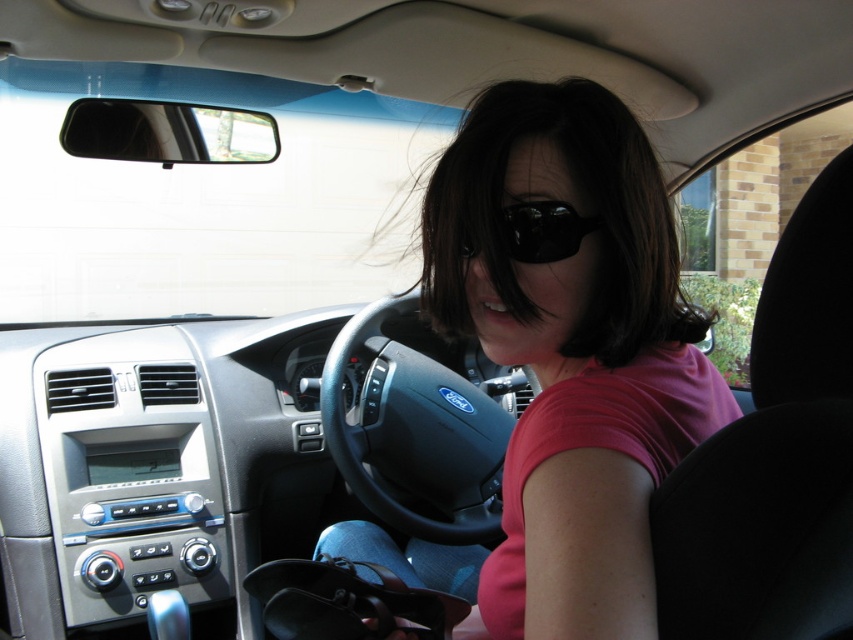
Question: Does pink matte shirt at center have a smaller size compared to black reflective sunglasses at center?

Choices:
 (A) yes
 (B) no

Answer: (B)

Question: In this image, where is pink matte shirt at center located relative to black reflective sunglasses at center?

Choices:
 (A) right
 (B) left

Answer: (A)

Question: In this image, where is pink matte shirt at center located relative to black reflective sunglasses at center?

Choices:
 (A) above
 (B) below

Answer: (B)

Question: Among these objects, which one is nearest to the camera?

Choices:
 (A) black reflective sunglasses at center
 (B) pink matte shirt at center

Answer: (B)